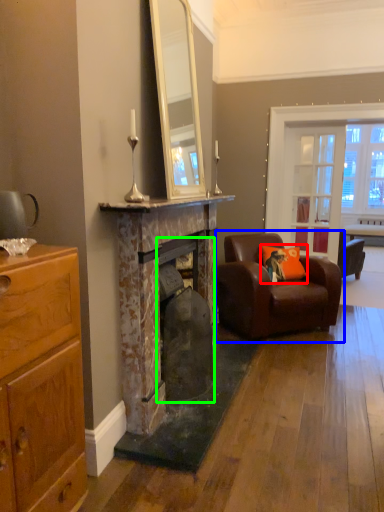
Question: Which object is positioned closest to pillow (highlighted by a red box)? Select from chair (highlighted by a blue box) and fireplace (highlighted by a green box).

Choices:
 (A) chair
 (B) fireplace

Answer: (A)